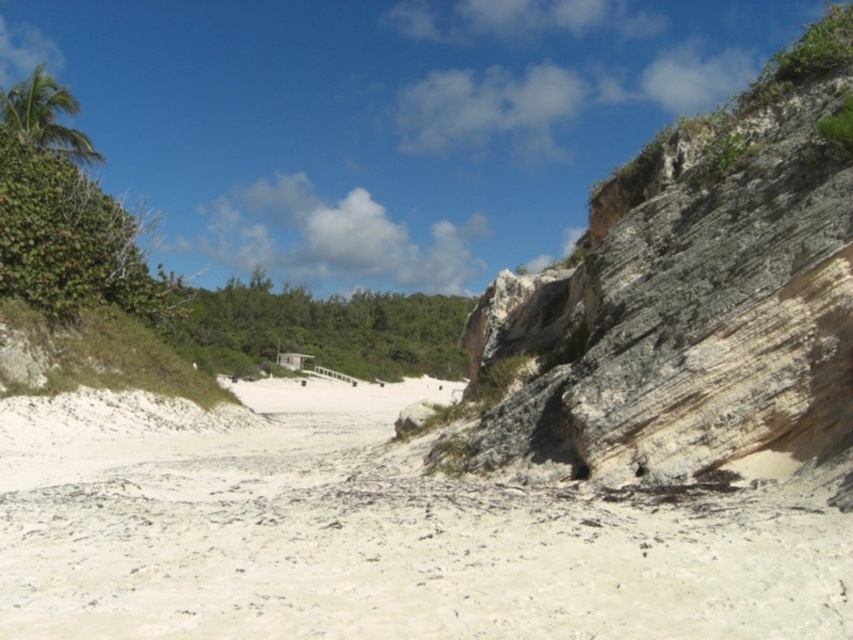
Describe the element at coordinates (695, 300) in the screenshot. I see `gray rocky cliff at right` at that location.

Does gray rocky cliff at right have a lesser width compared to green leafy bush at upper left?

Incorrect, gray rocky cliff at right's width is not less than green leafy bush at upper left's.

Which is behind, point (817, 184) or point (76, 282)?

The point (76, 282) is behind.

You are a GUI agent. You are given a task and a screenshot of the screen. Output one action in this format:
    pyautogui.click(x=<x>, y=<y>)
    Task: Click on the gray rocky cliff at right
    
    Given the screenshot: What is the action you would take?
    pyautogui.click(x=695, y=300)

Looking at this image, can you confirm if gray rocky cliff at right is thinner than green leafy palm tree at upper left?

Correct, gray rocky cliff at right's width is less than green leafy palm tree at upper left's.

Who is lower down, gray rocky cliff at right or green leafy palm tree at upper left?

gray rocky cliff at right is below.

Between point (708, 406) and point (51, 112), which one is positioned behind?

Positioned behind is point (51, 112).

What are the coordinates of `gray rocky cliff at right` in the screenshot? It's located at (695, 300).

How much distance is there between white sandy beach at center and gray rocky cliff at right?

They are 32.57 meters apart.

In the scene shown: Which is more to the left, white sandy beach at center or gray rocky cliff at right?

white sandy beach at center is more to the left.

Does point (241, 577) lie behind point (802, 435)?

No, it is not.

You are a GUI agent. You are given a task and a screenshot of the screen. Output one action in this format:
    pyautogui.click(x=<x>, y=<y>)
    Task: Click on the white sandy beach at center
    This screenshot has height=640, width=853.
    Given the screenshot: What is the action you would take?
    pyautogui.click(x=367, y=534)